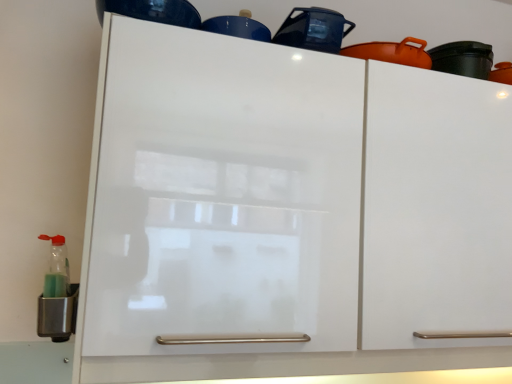
Question: Can you confirm if glossy blue cup at upper center, the 2th appliance viewed from the right, is positioned to the right of glossy ceramic pot at upper center, acting as the first appliance starting from the right?

Choices:
 (A) no
 (B) yes

Answer: (A)

Question: From a real-world perspective, is glossy blue cup at upper center, the second appliance from the left, beneath glossy ceramic pot at upper center, which ranks as the second appliance in top-to-bottom order?

Choices:
 (A) no
 (B) yes

Answer: (B)

Question: From the image's perspective, is glossy blue cup at upper center, the 2th appliance viewed from the right, below glossy ceramic pot at upper center, the 3th appliance in the left-to-right sequence?

Choices:
 (A) yes
 (B) no

Answer: (B)

Question: Is the depth of glossy blue cup at upper center, the 2th appliance viewed from the right, greater than that of glossy ceramic pot at upper center, which ranks as the second appliance in top-to-bottom order?

Choices:
 (A) no
 (B) yes

Answer: (B)

Question: Can you confirm if glossy blue cup at upper center, acting as the first appliance starting from the top, is thinner than glossy ceramic pot at upper center, acting as the first appliance starting from the right?

Choices:
 (A) yes
 (B) no

Answer: (A)

Question: From a real-world perspective, is glossy blue cup at upper center, the 2th appliance viewed from the right, above or below metallic green bottle at lower left, the 3th appliance in the right-to-left sequence?

Choices:
 (A) below
 (B) above

Answer: (B)

Question: From the image's perspective, is glossy blue cup at upper center, the third appliance in the bottom-to-top sequence, located above or below metallic green bottle at lower left, the 3th appliance in the right-to-left sequence?

Choices:
 (A) above
 (B) below

Answer: (A)

Question: Looking at the image, does glossy blue cup at upper center, the 2th appliance viewed from the right, seem bigger or smaller compared to metallic green bottle at lower left, placed as the 1th appliance when sorted from bottom to top?

Choices:
 (A) big
 (B) small

Answer: (B)

Question: In the image, is glossy blue cup at upper center, the third appliance in the bottom-to-top sequence, on the left side or the right side of metallic green bottle at lower left, the 3th appliance in the right-to-left sequence?

Choices:
 (A) left
 (B) right

Answer: (B)

Question: In the image, is glossy ceramic pot at upper center, acting as the first appliance starting from the right, positioned in front of or behind metallic green bottle at lower left, the 3th appliance when ordered from top to bottom?

Choices:
 (A) behind
 (B) front

Answer: (A)

Question: From the image's perspective, is glossy ceramic pot at upper center, which ranks as the 2th appliance in bottom-to-top order, positioned above or below metallic green bottle at lower left, placed as the 1th appliance when sorted from bottom to top?

Choices:
 (A) below
 (B) above

Answer: (B)

Question: Looking at their shapes, would you say glossy ceramic pot at upper center, which ranks as the second appliance in top-to-bottom order, is wider or thinner than metallic green bottle at lower left, the 3th appliance when ordered from top to bottom?

Choices:
 (A) wide
 (B) thin

Answer: (A)

Question: Is point (301, 8) positioned closer to the camera than point (74, 296)?

Choices:
 (A) farther
 (B) closer

Answer: (A)

Question: Is metallic green bottle at lower left, the 3th appliance in the right-to-left sequence, wider or thinner than glossy ceramic pot at upper center, which ranks as the 2th appliance in bottom-to-top order?

Choices:
 (A) thin
 (B) wide

Answer: (A)

Question: Is metallic green bottle at lower left, placed as the 1th appliance when sorted from left to right, bigger or smaller than glossy ceramic pot at upper center, which ranks as the second appliance in top-to-bottom order?

Choices:
 (A) big
 (B) small

Answer: (B)